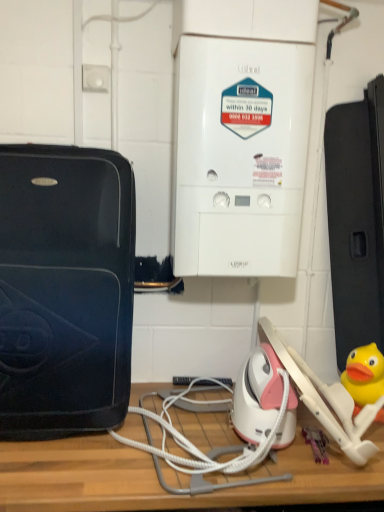
Question: Is matte black suitcase at left, marked as the second home appliance in a right-to-left arrangement, smaller than white cord at center?

Choices:
 (A) no
 (B) yes

Answer: (A)

Question: Is matte black suitcase at left, which is the first home appliance in left-to-right order, facing towards white cord at center?

Choices:
 (A) yes
 (B) no

Answer: (B)

Question: Is matte black suitcase at left, which is the first home appliance in left-to-right order, taller than white cord at center?

Choices:
 (A) no
 (B) yes

Answer: (B)

Question: Is matte black suitcase at left, which is the first home appliance in left-to-right order, to the right of white cord at center from the viewer's perspective?

Choices:
 (A) no
 (B) yes

Answer: (A)

Question: Is matte black suitcase at left, marked as the second home appliance in a right-to-left arrangement, positioned beyond the bounds of white cord at center?

Choices:
 (A) yes
 (B) no

Answer: (A)

Question: Considering the positions of matte black suitcase at left, marked as the second home appliance in a right-to-left arrangement, and wooden table at center in the image, is matte black suitcase at left, marked as the second home appliance in a right-to-left arrangement, wider or thinner than wooden table at center?

Choices:
 (A) wide
 (B) thin

Answer: (B)

Question: Choose the correct answer: Is matte black suitcase at left, marked as the second home appliance in a right-to-left arrangement, inside wooden table at center or outside it?

Choices:
 (A) outside
 (B) inside

Answer: (A)

Question: From a real-world perspective, is matte black suitcase at left, marked as the second home appliance in a right-to-left arrangement, positioned above or below wooden table at center?

Choices:
 (A) below
 (B) above

Answer: (B)

Question: Would you say matte black suitcase at left, marked as the second home appliance in a right-to-left arrangement, is to the left or to the right of wooden table at center in the picture?

Choices:
 (A) right
 (B) left

Answer: (B)

Question: Is white cord at center taller or shorter than white plastic boiler at center, placed as the second home appliance when sorted from left to right?

Choices:
 (A) short
 (B) tall

Answer: (A)

Question: Based on their positions, is white cord at center located to the left or right of white plastic boiler at center, the 1th home appliance in the right-to-left sequence?

Choices:
 (A) left
 (B) right

Answer: (A)

Question: Does point (175, 458) appear closer or farther from the camera than point (231, 59)?

Choices:
 (A) closer
 (B) farther

Answer: (A)

Question: From a real-world perspective, is white cord at center physically located above or below white plastic boiler at center, placed as the second home appliance when sorted from left to right?

Choices:
 (A) below
 (B) above

Answer: (A)

Question: From the image's perspective, relative to yellow rubber duck at lower right, is white cord at center above or below?

Choices:
 (A) below
 (B) above

Answer: (A)

Question: Do you think white cord at center is within yellow rubber duck at lower right, or outside of it?

Choices:
 (A) outside
 (B) inside

Answer: (A)